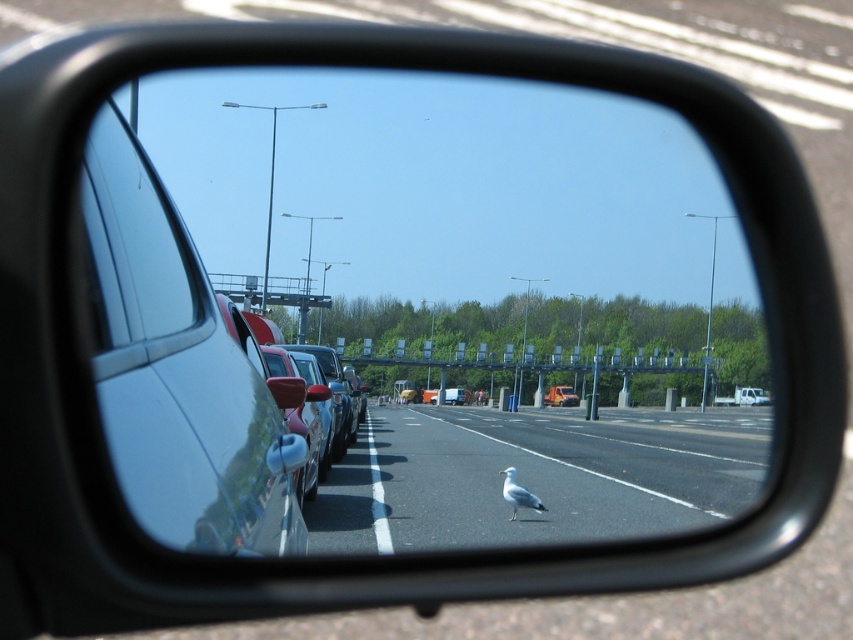
Can you confirm if glossy metallic car window at left is positioned to the left of clear glass car window at left?

Incorrect, glossy metallic car window at left is not on the left side of clear glass car window at left.

Which is behind, point (202, 474) or point (138, 209)?

The point (138, 209) is more distant.

Where is `glossy metallic car window at left`? Image resolution: width=853 pixels, height=640 pixels. glossy metallic car window at left is located at coordinates (178, 371).

Is point (175, 420) closer to viewer compared to point (108, 276)?

Yes, point (175, 420) is closer to viewer.

You are a GUI agent. You are given a task and a screenshot of the screen. Output one action in this format:
    pyautogui.click(x=<x>, y=<y>)
    Task: Click on the glossy metallic mirror at center
    
    Given the screenshot: What is the action you would take?
    pyautogui.click(x=409, y=307)

Which is more to the left, smooth asphalt highway at center or clear glass car window at left?

clear glass car window at left is more to the left.

Between smooth asphalt highway at center and clear glass car window at left, which one is positioned lower?

Positioned lower is smooth asphalt highway at center.

Which is in front, point (724, 502) or point (141, 262)?

Positioned in front is point (141, 262).

Find the location of `smooth asphalt highway at center`. smooth asphalt highway at center is located at coordinates (535, 476).